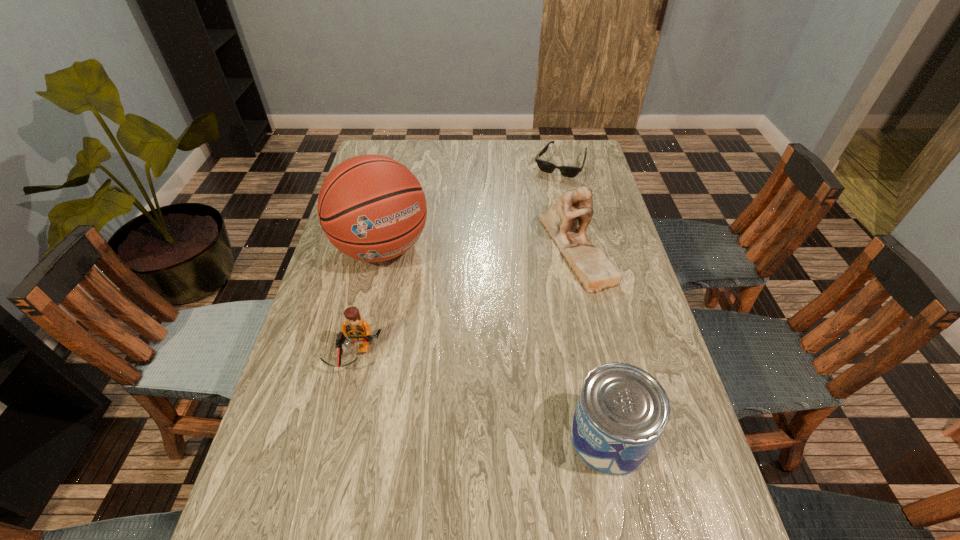
In order to click on free space that satisfies the following two spatial constraints: 1. holding a crossbow in the hands of the nearest object; 2. on the front label of the fourth tallest object in this screenshot , I will do `click(336, 437)`.

Find the location of a particular element. free space that satisfies the following two spatial constraints: 1. on the back side of the basketball; 2. on the right side of the figurine is located at coordinates (382, 246).